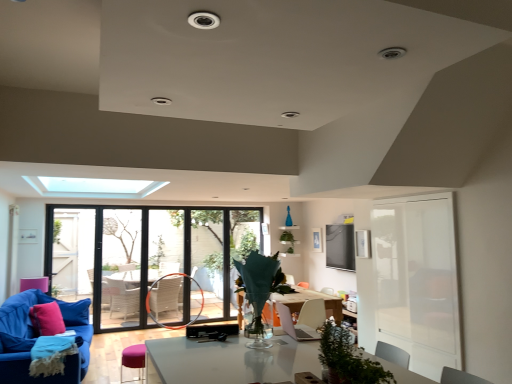
Question: From a real-world perspective, is velvet blue couch at lower left located higher than pink fabric pillow at lower left?

Choices:
 (A) no
 (B) yes

Answer: (A)

Question: From the image's perspective, is velvet blue couch at lower left below pink fabric pillow at lower left?

Choices:
 (A) no
 (B) yes

Answer: (B)

Question: Can you confirm if velvet blue couch at lower left is taller than pink fabric pillow at lower left?

Choices:
 (A) yes
 (B) no

Answer: (A)

Question: Is velvet blue couch at lower left turned away from pink fabric pillow at lower left?

Choices:
 (A) no
 (B) yes

Answer: (B)

Question: Considering the relative sizes of velvet blue couch at lower left and pink fabric pillow at lower left in the image provided, is velvet blue couch at lower left wider than pink fabric pillow at lower left?

Choices:
 (A) yes
 (B) no

Answer: (A)

Question: Looking at their shapes, would you say clear glass window at center is wider or thinner than velvet blue couch at lower left?

Choices:
 (A) wide
 (B) thin

Answer: (B)

Question: Visually, is clear glass window at center positioned to the left or to the right of velvet blue couch at lower left?

Choices:
 (A) left
 (B) right

Answer: (B)

Question: Is clear glass window at center inside the boundaries of velvet blue couch at lower left, or outside?

Choices:
 (A) outside
 (B) inside

Answer: (A)

Question: Is clear glass window at center taller or shorter than velvet blue couch at lower left?

Choices:
 (A) tall
 (B) short

Answer: (A)

Question: Is velvet blue couch at lower left in front of or behind purple fabric stool at lower left in the image?

Choices:
 (A) behind
 (B) front

Answer: (B)

Question: Based on their positions, is velvet blue couch at lower left located to the left or right of purple fabric stool at lower left?

Choices:
 (A) right
 (B) left

Answer: (B)

Question: From a real-world perspective, is velvet blue couch at lower left physically located above or below purple fabric stool at lower left?

Choices:
 (A) below
 (B) above

Answer: (B)

Question: Looking at their shapes, would you say velvet blue couch at lower left is wider or thinner than purple fabric stool at lower left?

Choices:
 (A) wide
 (B) thin

Answer: (A)

Question: In terms of height, does purple fabric stool at lower left look taller or shorter compared to green matte plant at center?

Choices:
 (A) tall
 (B) short

Answer: (B)

Question: Considering the positions of purple fabric stool at lower left and green matte plant at center in the image, is purple fabric stool at lower left bigger or smaller than green matte plant at center?

Choices:
 (A) small
 (B) big

Answer: (B)